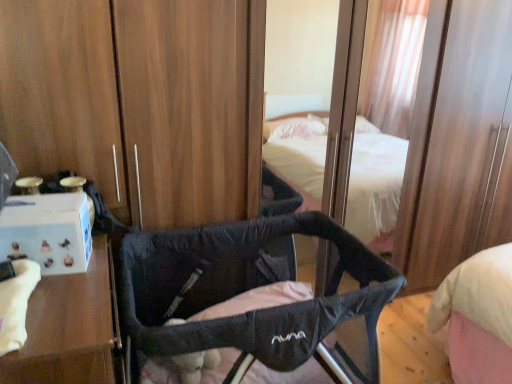
Where is `black fabric infant bed at center`? This screenshot has width=512, height=384. black fabric infant bed at center is located at coordinates (246, 289).

The height and width of the screenshot is (384, 512). Describe the element at coordinates (246, 289) in the screenshot. I see `black fabric infant bed at center` at that location.

Measure the distance between white cardboard box at left and camera.

A distance of 1.05 meters exists between white cardboard box at left and camera.

Describe the element at coordinates (71, 328) in the screenshot. This screenshot has width=512, height=384. I see `white cardboard box at left` at that location.

What are the coordinates of `white cardboard box at left` in the screenshot? It's located at (71, 328).

At what (x,y) coordinates should I click in order to perform the action: click on black fabric infant bed at center. Please return your answer as a coordinate pair (x, y). Looking at the image, I should click on (246, 289).

Can you confirm if black fabric infant bed at center is positioned to the right of white cardboard box at left?

Yes.

Considering the positions of objects black fabric infant bed at center and white cardboard box at left in the image provided, who is in front, black fabric infant bed at center or white cardboard box at left?

white cardboard box at left is closer to the camera.

Is point (340, 268) in front of point (30, 348)?

No.

Looking at this image, from the image's perspective, which is below, black fabric infant bed at center or white cardboard box at left?

white cardboard box at left.

From a real-world perspective, is black fabric infant bed at center positioned over white cardboard box at left based on gravity?

No.

Considering the relative sizes of black fabric infant bed at center and white cardboard box at left in the image provided, is black fabric infant bed at center wider than white cardboard box at left?

Indeed, black fabric infant bed at center has a greater width compared to white cardboard box at left.

Between black fabric infant bed at center and white cardboard box at left, which one has less height?

Standing shorter between the two is black fabric infant bed at center.

Can you confirm if black fabric infant bed at center is smaller than white cardboard box at left?

No.

Would you say black fabric infant bed at center is outside white cardboard box at left?

That's correct, black fabric infant bed at center is outside of white cardboard box at left.

Is black fabric infant bed at center placed right next to white cardboard box at left?

There is a gap between black fabric infant bed at center and white cardboard box at left.

Is black fabric infant bed at center oriented towards white cardboard box at left?

No, black fabric infant bed at center is not aimed at white cardboard box at left.

The image size is (512, 384). Identify the location of infant bed above the white cardboard box at left (from the image's perspective). (246, 289).

Is white cardboard box at left to the left or to the right of black fabric infant bed at center in the image?

Based on their positions, white cardboard box at left is located to the left of black fabric infant bed at center.

Does white cardboard box at left lie behind black fabric infant bed at center?

No, white cardboard box at left is closer to the camera.

Which point is more distant from viewer, (73, 328) or (222, 266)?

Point (222, 266)

From the image's perspective, is white cardboard box at left located beneath black fabric infant bed at center?

Yes, from the image's perspective, white cardboard box at left is beneath black fabric infant bed at center.

From a real-world perspective, is white cardboard box at left positioned under black fabric infant bed at center based on gravity?

No, from a real-world perspective, white cardboard box at left is not under black fabric infant bed at center.

Looking at this image, in terms of width, does white cardboard box at left look wider or thinner when compared to black fabric infant bed at center?

white cardboard box at left is thinner than black fabric infant bed at center.

Considering the sizes of white cardboard box at left and black fabric infant bed at center in the image, is white cardboard box at left taller or shorter than black fabric infant bed at center?

In the image, white cardboard box at left appears to be taller than black fabric infant bed at center.

Is white cardboard box at left smaller than black fabric infant bed at center?

Correct, white cardboard box at left occupies less space than black fabric infant bed at center.

Can black fabric infant bed at center be found inside white cardboard box at left?

No, black fabric infant bed at center is not a part of white cardboard box at left.

Based on the photo, is there a large distance between white cardboard box at left and black fabric infant bed at center?

That's not correct — white cardboard box at left is a little close to black fabric infant bed at center.

Could you tell me if white cardboard box at left is turned towards black fabric infant bed at center?

Yes.

Looking at this image, how different are the orientations of white cardboard box at left and black fabric infant bed at center in degrees?

They differ by 90 degrees in their facing directions.

How much distance is there between white cardboard box at left and black fabric infant bed at center?

A distance of 16.08 inches exists between white cardboard box at left and black fabric infant bed at center.

Locate an element on the screen. This screenshot has width=512, height=384. furniture below the black fabric infant bed at center (from the image's perspective) is located at coordinates (71, 328).

Where is `infant bed behind the white cardboard box at left`? The height and width of the screenshot is (384, 512). infant bed behind the white cardboard box at left is located at coordinates (246, 289).

Locate an element on the screen. infant bed below the white cardboard box at left (from a real-world perspective) is located at coordinates coord(246,289).